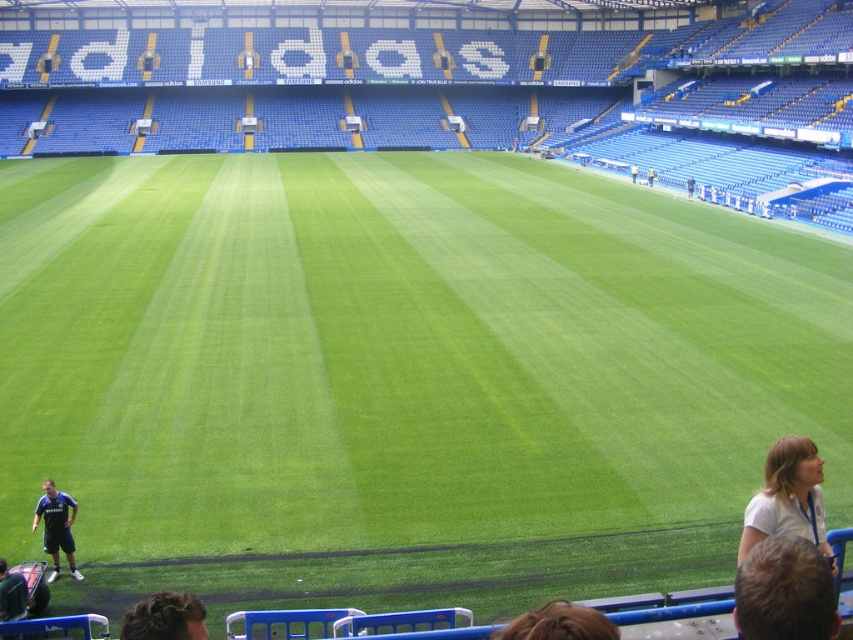
Which is in front, point (584, 628) or point (44, 506)?

Positioned in front is point (584, 628).

Measure the distance from brown hair at lower center to blue jersey at lower left.

brown hair at lower center is 7.66 meters away from blue jersey at lower left.

Is point (578, 605) closer to viewer compared to point (62, 525)?

Yes, point (578, 605) is closer to viewer.

Find the location of a particular element. The height and width of the screenshot is (640, 853). brown hair at lower center is located at coordinates (560, 624).

Does white matte shirt at lower right appear on the right side of brown hair at lower center?

Indeed, white matte shirt at lower right is positioned on the right side of brown hair at lower center.

Which of these two, white matte shirt at lower right or brown hair at lower center, stands taller?

Standing taller between the two is white matte shirt at lower right.

The height and width of the screenshot is (640, 853). In order to click on white matte shirt at lower right in this screenshot , I will do `click(787, 497)`.

Is blonde hair at lower right positioned before brown hair at lower center?

No.

This screenshot has height=640, width=853. Describe the element at coordinates (785, 592) in the screenshot. I see `blonde hair at lower right` at that location.

Is point (788, 548) positioned in front of point (544, 634)?

That is False.

Where is `blonde hair at lower right`? blonde hair at lower right is located at coordinates tap(785, 592).